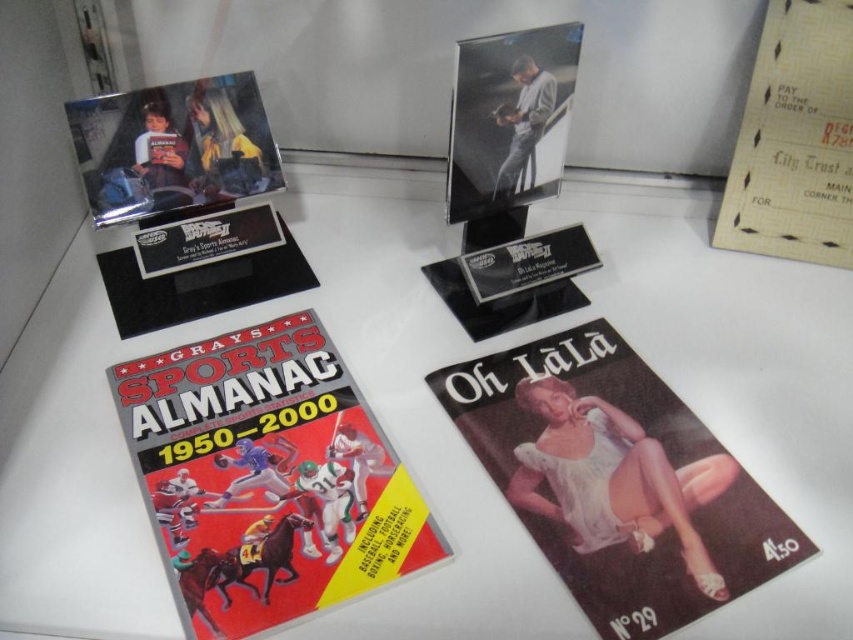
Looking at this image, which is below, multicolored paper sports almanac at lower left or matte plastic photo at upper left?

Positioned lower is multicolored paper sports almanac at lower left.

Between multicolored paper sports almanac at lower left and matte plastic photo at upper left, which one has more height?

With more height is multicolored paper sports almanac at lower left.

Which is behind, point (390, 525) or point (257, 122)?

Point (257, 122)

Image resolution: width=853 pixels, height=640 pixels. What are the coordinates of `multicolored paper sports almanac at lower left` in the screenshot? It's located at (267, 477).

Is yellow paper check at upper right positioned behind matte black photo frame at center?

Yes, it is behind matte black photo frame at center.

Which is more to the right, yellow paper check at upper right or matte black photo frame at center?

yellow paper check at upper right is more to the right.

This screenshot has width=853, height=640. What do you see at coordinates (793, 140) in the screenshot?
I see `yellow paper check at upper right` at bounding box center [793, 140].

Identify the location of yellow paper check at upper right. This screenshot has height=640, width=853. (793, 140).

Is multicolored paper sports almanac at lower left behind matte black photo frame at center?

No, it is in front of matte black photo frame at center.

Between point (190, 508) and point (532, 70), which one is positioned in front?

Positioned in front is point (190, 508).

What are the coordinates of `multicolored paper sports almanac at lower left` in the screenshot? It's located at (267, 477).